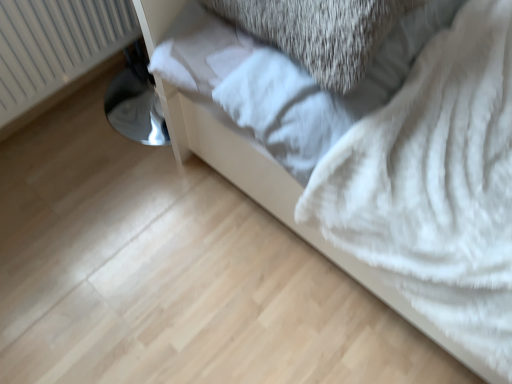
Where is `vacant space in front of white plastic radiator at left`? vacant space in front of white plastic radiator at left is located at coordinates (62, 162).